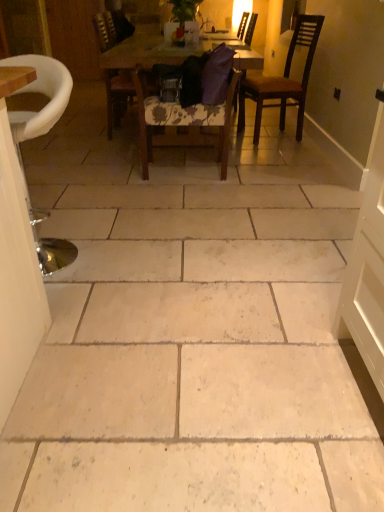
Locate an element on the screen. vacant area on the back side of metallic silver stool at left, which is the 5th chair from back to front is located at coordinates (91, 217).